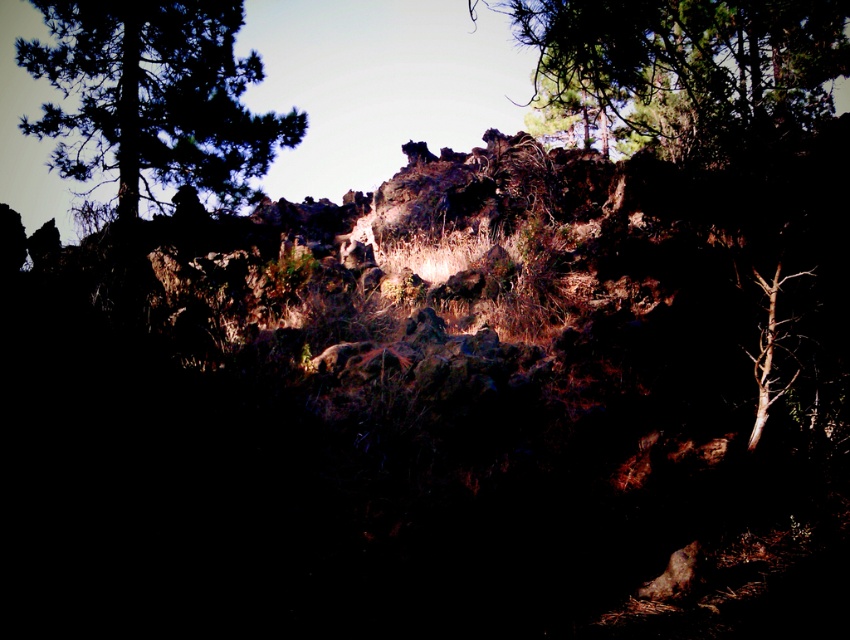
Who is positioned more to the left, green leafy tree at upper left or green leafy tree at upper center?

Positioned to the left is green leafy tree at upper left.

Consider the image. Is green leafy tree at upper left taller than green leafy tree at upper center?

No, green leafy tree at upper left is not taller than green leafy tree at upper center.

Is point (173, 104) positioned after point (639, 124)?

No, it is in front of (639, 124).

Find the location of a particular element. The height and width of the screenshot is (640, 850). green leafy tree at upper left is located at coordinates (153, 97).

Measure the distance between brown textured tree at center and camera.

They are 6.84 meters apart.

Is brown textured tree at center wider than green leafy tree at upper left?

Indeed, brown textured tree at center has a greater width compared to green leafy tree at upper left.

Which is in front, point (697, 92) or point (230, 180)?

Positioned in front is point (230, 180).

At what (x,y) coordinates should I click in order to perform the action: click on brown textured tree at center. Please return your answer as a coordinate pair (x, y). Looking at the image, I should click on (712, 120).

Is brown textured tree at center taller than green leafy tree at upper center?

Correct, brown textured tree at center is much taller as green leafy tree at upper center.

Is point (732, 128) behind point (672, 49)?

Yes, point (732, 128) is farther from viewer.

The width and height of the screenshot is (850, 640). In order to click on brown textured tree at center in this screenshot , I will do `click(712, 120)`.